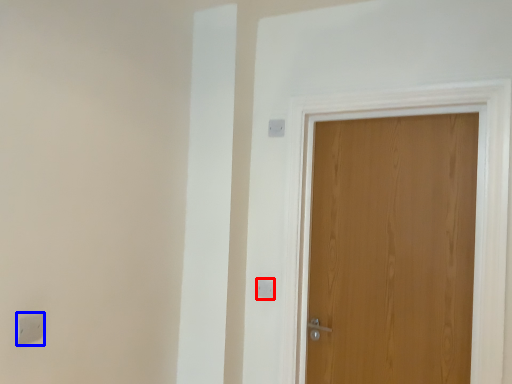
Question: Among these objects, which one is nearest to the camera, light switch (highlighted by a red box) or light switch (highlighted by a blue box)?

Choices:
 (A) light switch
 (B) light switch

Answer: (B)